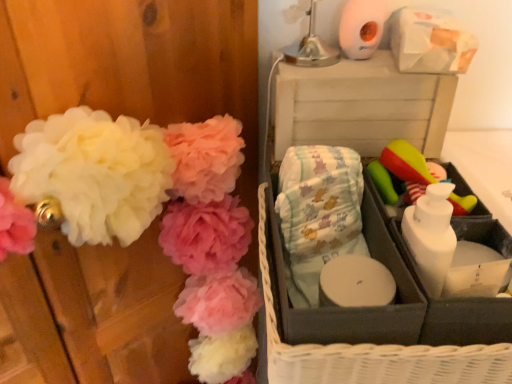
Describe the element at coordinates (361, 106) in the screenshot. I see `white plastic storage box at upper right` at that location.

This screenshot has height=384, width=512. What do you see at coordinates (362, 27) in the screenshot?
I see `white matte toilet paper at upper right` at bounding box center [362, 27].

Describe the element at coordinates (157, 212) in the screenshot. This screenshot has width=512, height=384. I see `white fluffy pom-poms at left` at that location.

You are a GUI agent. You are given a task and a screenshot of the screen. Output one action in this format:
    pyautogui.click(x=<x>, y=<y>)
    Task: Click on the white fluffy pom-poms at left
    This screenshot has height=384, width=512.
    Given the screenshot: What is the action you would take?
    pyautogui.click(x=157, y=212)

Find the location of a particular element. The height and width of the screenshot is (384, 512). green rubber brush at right is located at coordinates (406, 163).

Describe the element at coordinates (384, 323) in the screenshot. I see `gray fabric basket at right` at that location.

Locate an element on the screen. This screenshot has width=512, height=384. white plastic storage box at upper right is located at coordinates (361, 106).

Is light blue fabric diapers at center with white fluffy pom-poms at left?

There is a gap between light blue fabric diapers at center and white fluffy pom-poms at left.

From the picture: Considering the positions of objects light blue fabric diapers at center and white fluffy pom-poms at left in the image provided, who is more to the right, light blue fabric diapers at center or white fluffy pom-poms at left?

light blue fabric diapers at center.

Can you tell me how much light blue fabric diapers at center and white fluffy pom-poms at left differ in facing direction?

The angle between the facing direction of light blue fabric diapers at center and the facing direction of white fluffy pom-poms at left is 37.5 degrees.

Where is `material that appears behind the white fluffy pom-poms at left`? material that appears behind the white fluffy pom-poms at left is located at coordinates (319, 198).

In the image, there is a white fluffy pom-poms at left. At what (x,y) coordinates should I click in order to perform the action: click on toy above it (from the image's perspective). Please return your answer as a coordinate pair (x, y). The width and height of the screenshot is (512, 384). Looking at the image, I should click on (406, 163).

Which is more distant, (393, 151) or (243, 155)?

The point (243, 155) is farther.

Does green rubber brush at right lie in front of white fluffy pom-poms at left?

No, green rubber brush at right is further to the viewer.

Considering the sizes of objects green rubber brush at right and white fluffy pom-poms at left in the image provided, who is bigger, green rubber brush at right or white fluffy pom-poms at left?

white fluffy pom-poms at left.

Relative to light blue fabric diapers at center, is white plastic storage box at upper right in front or behind?

white plastic storage box at upper right is behind light blue fabric diapers at center.

Is white plastic storage box at upper right to the left of light blue fabric diapers at center from the viewer's perspective?

No.

Is white plastic storage box at upper right thinner than light blue fabric diapers at center?

Incorrect, the width of white plastic storage box at upper right is not less than that of light blue fabric diapers at center.

From a real-world perspective, is white plastic storage box at upper right positioned under white matte toilet paper at upper right based on gravity?

Yes, from a real-world perspective, white plastic storage box at upper right is below white matte toilet paper at upper right.

Which object is wider, white plastic storage box at upper right or white matte toilet paper at upper right?

Wider between the two is white plastic storage box at upper right.

Is white plastic storage box at upper right touching white matte toilet paper at upper right?

No, white plastic storage box at upper right is not with white matte toilet paper at upper right.

From the image's perspective, is light blue fabric diapers at center above or below white plastic storage box at upper right?

Based on their image positions, light blue fabric diapers at center is located beneath white plastic storage box at upper right.

Which is more to the right, light blue fabric diapers at center or white plastic storage box at upper right?

From the viewer's perspective, white plastic storage box at upper right appears more on the right side.

In order to click on storage box above the light blue fabric diapers at center (from the image's perspective) in this screenshot , I will do coord(361,106).

Which object is closer to the camera, light blue fabric diapers at center or white plastic storage box at upper right?

light blue fabric diapers at center is closer to the camera.

Does light blue fabric diapers at center turn towards white matte toilet paper at upper right?

No, light blue fabric diapers at center does not turn towards white matte toilet paper at upper right.

Looking at this image, from a real-world perspective, which object rests below the other?

light blue fabric diapers at center, from a real-world perspective.

From the image's perspective, is light blue fabric diapers at center on top of white matte toilet paper at upper right?

No, from the image's perspective, light blue fabric diapers at center is not on top of white matte toilet paper at upper right.

Considering the positions of point (304, 243) and point (358, 35), is point (304, 243) closer or farther from the camera than point (358, 35)?

Clearly, point (304, 243) is closer to the camera than point (358, 35).

Is gray fabric basket at right in contact with white fluffy pom-poms at left?

No, gray fabric basket at right is not making contact with white fluffy pom-poms at left.

Which object is closer to the camera, gray fabric basket at right or white fluffy pom-poms at left?

Positioned in front is white fluffy pom-poms at left.

Can you confirm if gray fabric basket at right is wider than white fluffy pom-poms at left?

Yes.

From a real-world perspective, does gray fabric basket at right stand above white fluffy pom-poms at left?

Yes, from a real-world perspective, gray fabric basket at right is above white fluffy pom-poms at left.

You are a GUI agent. You are given a task and a screenshot of the screen. Output one action in this format:
    pyautogui.click(x=<x>, y=<y>)
    Task: Click on the material above the white fluffy pom-poms at left (from a real-world perspective)
    This screenshot has height=384, width=512.
    Given the screenshot: What is the action you would take?
    pyautogui.click(x=319, y=198)

Identify the location of flower located on the left of green rubber brush at right. (157, 212).

When comparing their distances from light blue fabric diapers at center, does white fluffy pom-poms at left or white matte toilet paper at upper right seem further?

The object further to light blue fabric diapers at center is white matte toilet paper at upper right.

Estimate the real-world distances between objects in this image. Which object is further from green rubber brush at right, gray fabric basket at right or white plastic storage box at upper right?

gray fabric basket at right lies further to green rubber brush at right than the other object.

Based on their spatial positions, is light blue fabric diapers at center or white plastic storage box at upper right further from white fluffy pom-poms at left?

white plastic storage box at upper right.

Based on their spatial positions, is white matte toilet paper at upper right or green rubber brush at right further from white fluffy pom-poms at left?

The object further to white fluffy pom-poms at left is white matte toilet paper at upper right.

From the image, which object appears to be farther from green rubber brush at right, white matte toilet paper at upper right or light blue fabric diapers at center?

The object further to green rubber brush at right is white matte toilet paper at upper right.

When comparing their distances from white matte toilet paper at upper right, does white fluffy pom-poms at left or gray fabric basket at right seem further?

Among the two, white fluffy pom-poms at left is located further to white matte toilet paper at upper right.

Looking at the image, which one is located further to light blue fabric diapers at center, white matte toilet paper at upper right or white fluffy pom-poms at left?

The object further to light blue fabric diapers at center is white matte toilet paper at upper right.

Looking at the image, which one is located closer to light blue fabric diapers at center, gray fabric basket at right or white plastic storage box at upper right?

gray fabric basket at right lies closer to light blue fabric diapers at center than the other object.

The width and height of the screenshot is (512, 384). What are the coordinates of `storage box that lies between white matte toilet paper at upper right and white fluffy pom-poms at left from top to bottom` in the screenshot? It's located at (361, 106).

Where is `storage box that lies between white matte toilet paper at upper right and gray fabric basket at right from top to bottom`? Image resolution: width=512 pixels, height=384 pixels. storage box that lies between white matte toilet paper at upper right and gray fabric basket at right from top to bottom is located at coordinates (361, 106).

You are a GUI agent. You are given a task and a screenshot of the screen. Output one action in this format:
    pyautogui.click(x=<x>, y=<y>)
    Task: Click on the basket between white fluffy pom-poms at left and green rubber brush at right
    This screenshot has height=384, width=512.
    Given the screenshot: What is the action you would take?
    pyautogui.click(x=384, y=323)

Where is `storage box between white matte toilet paper at upper right and green rubber brush at right in the vertical direction`? storage box between white matte toilet paper at upper right and green rubber brush at right in the vertical direction is located at coordinates (361, 106).